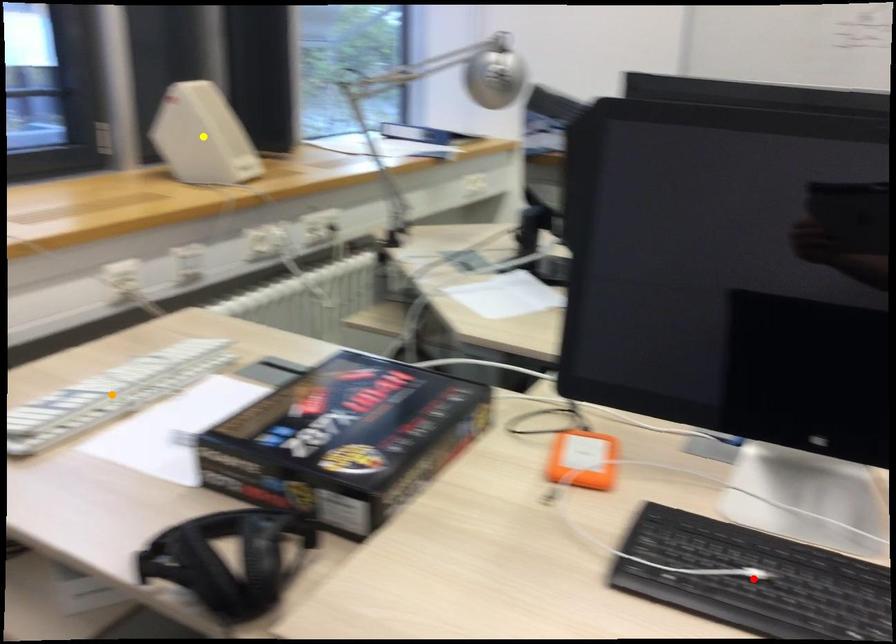
Order these from farthest to nearest:
yellow point, orange point, red point

yellow point < orange point < red point